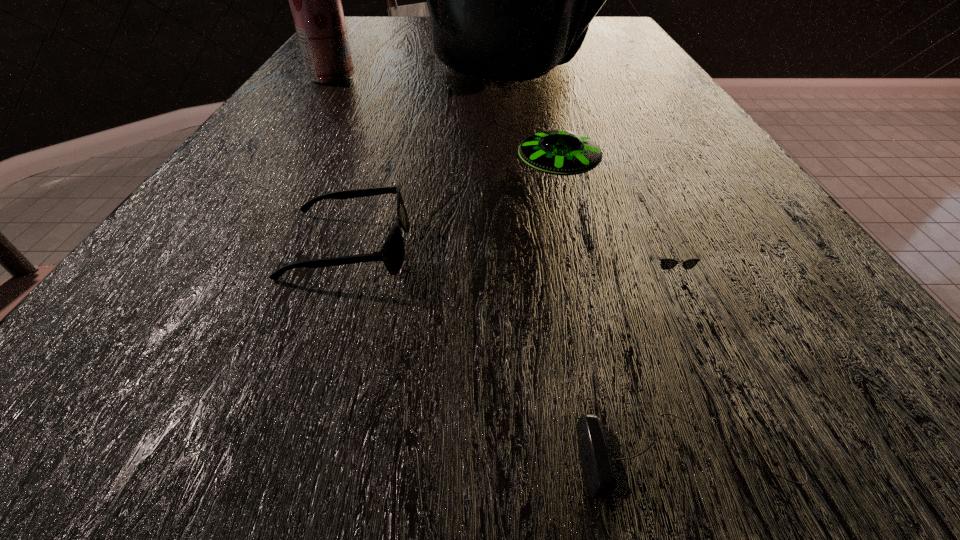
In order to click on unoccupied area between the shortest object and the plastic bag in this screenshot , I will do `click(600, 261)`.

Identify the location of free space between the left sunglasses and the fourth shortest object. Image resolution: width=960 pixels, height=540 pixels. (452, 210).

Image resolution: width=960 pixels, height=540 pixels. I want to click on vacant space that is in between the leftmost object and the right sunglasses, so click(x=498, y=176).

Locate an element on the screen. vacant space in between the saucer and the tallest object is located at coordinates (536, 116).

Locate an element on the screen. This screenshot has width=960, height=540. empty space between the plastic bag and the shortest object is located at coordinates (600, 261).

Locate an element on the screen. This screenshot has width=960, height=540. empty location between the plastic bag and the fifth shortest object is located at coordinates (422, 69).

Locate an element on the screen. The image size is (960, 540). unoccupied area between the webcam and the right sunglasses is located at coordinates (676, 367).

Locate an element on the screen. The height and width of the screenshot is (540, 960). free spot between the second tallest object and the webcam is located at coordinates (510, 268).

Where is `empty space between the right sunglasses and the left sunglasses`? empty space between the right sunglasses and the left sunglasses is located at coordinates (506, 261).

At what (x,y) coordinates should I click in order to perform the action: click on object that is the third closest to the right sunglasses. Please return your answer as a coordinate pair (x, y). The width and height of the screenshot is (960, 540). Looking at the image, I should click on coord(392,254).